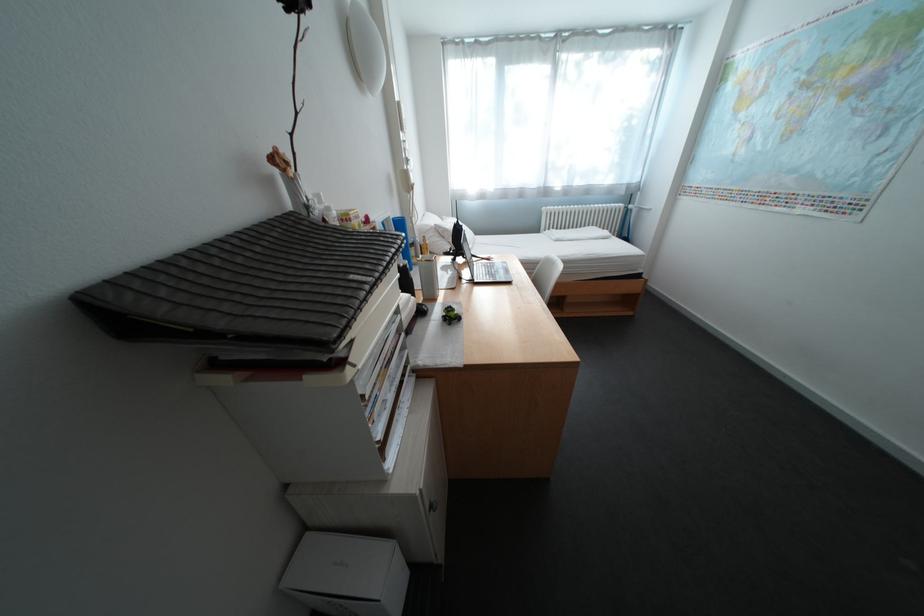
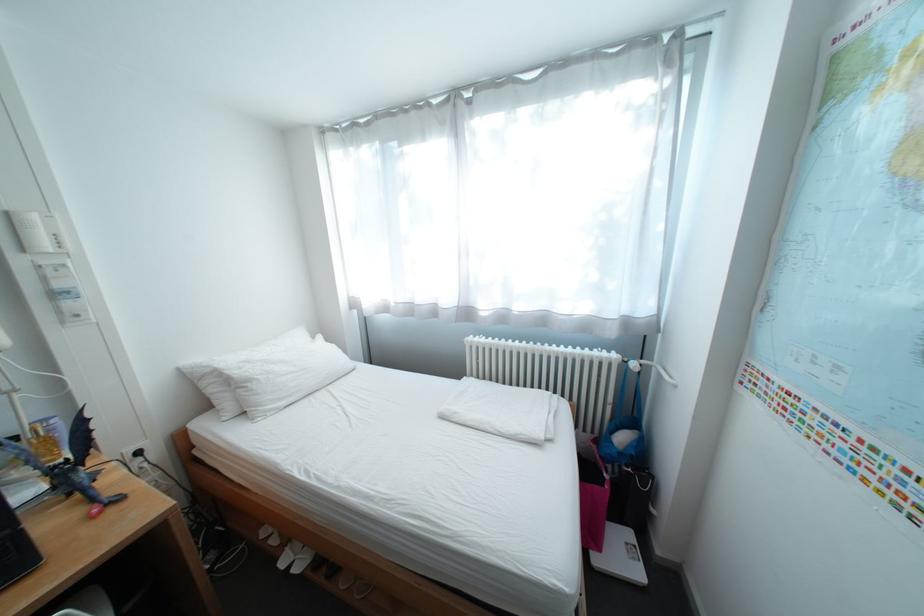
Find the pixel in the second image that matches point 638,208 in the first image.

(637, 362)